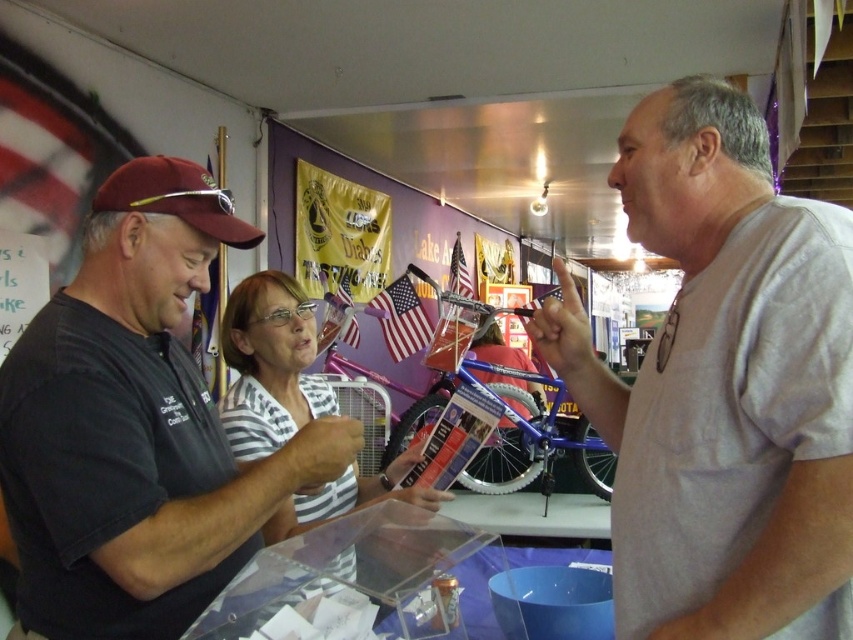
Is point (637, 154) in front of point (202, 228)?

Yes, it is in front of point (202, 228).

Does gray cotton t-shirt at right appear over maroon fabric baseball cap at left?

Incorrect, gray cotton t-shirt at right is not positioned above maroon fabric baseball cap at left.

Describe the element at coordinates (724, 385) in the screenshot. The image size is (853, 640). I see `gray cotton t-shirt at right` at that location.

Identify the location of gray cotton t-shirt at right. (724, 385).

Measure the distance from gray cotton t-shirt at right to white striped shirt at center.

gray cotton t-shirt at right is 24.55 inches from white striped shirt at center.

Who is more forward, (701, 234) or (294, 292)?

Point (701, 234) is more forward.

This screenshot has width=853, height=640. I want to click on gray cotton t-shirt at right, so click(x=724, y=385).

Can you confirm if white striped shirt at center is positioned to the right of maroon fabric baseball cap at left?

Yes, white striped shirt at center is to the right of maroon fabric baseball cap at left.

Does white striped shirt at center come in front of maroon fabric baseball cap at left?

No, white striped shirt at center is further to the viewer.

Between point (389, 465) and point (115, 179), which one is positioned in front?

Point (115, 179) is more forward.

The image size is (853, 640). In order to click on white striped shirt at center in this screenshot , I will do `click(270, 364)`.